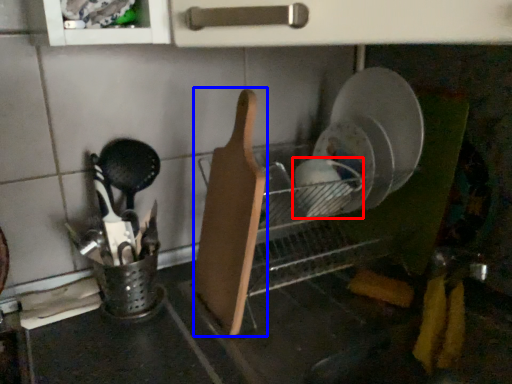
Question: Among these objects, which one is nearest to the camera, tableware (highlighted by a red box) or cutting board (highlighted by a blue box)?

Choices:
 (A) tableware
 (B) cutting board

Answer: (B)